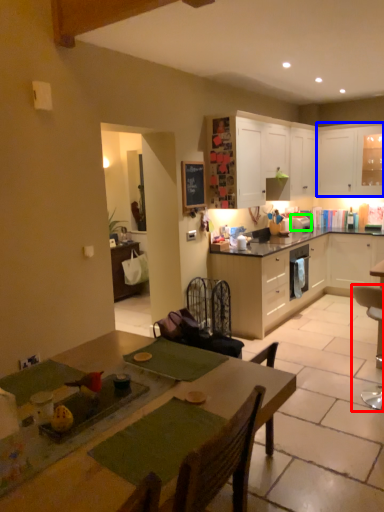
Question: Considering the real-world distances, which object is closest to chair (highlighted by a red box)? cabinetry (highlighted by a blue box) or appliance (highlighted by a green box).

Choices:
 (A) cabinetry
 (B) appliance

Answer: (B)